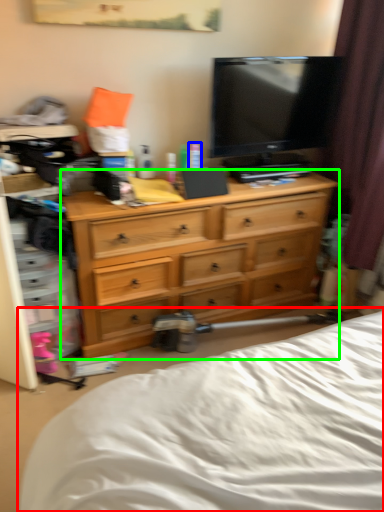
Question: Based on their relative distances, which object is farther from bed (highlighted by a red box)? Choose from toiletry (highlighted by a blue box) and chest of drawers (highlighted by a green box).

Choices:
 (A) toiletry
 (B) chest of drawers

Answer: (A)